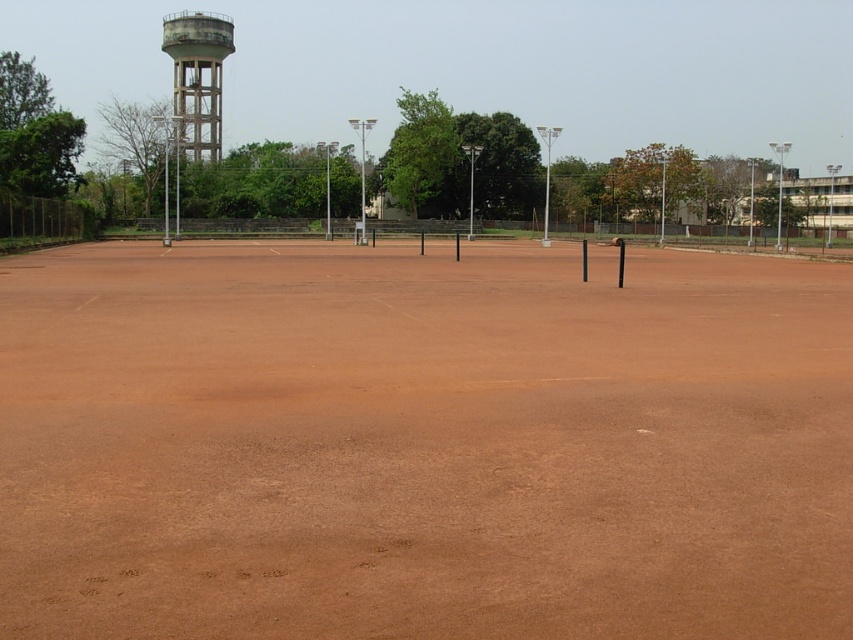
Question: Is the position of brown clay court at center more distant than that of concrete water tower at upper left?

Choices:
 (A) yes
 (B) no

Answer: (B)

Question: Which point is farther from the camera taking this photo?

Choices:
 (A) (657, 449)
 (B) (183, 49)

Answer: (B)

Question: Can you confirm if brown clay court at center is smaller than concrete water tower at upper left?

Choices:
 (A) no
 (B) yes

Answer: (B)

Question: Among these objects, which one is farthest from the camera?

Choices:
 (A) concrete water tower at upper left
 (B) brown clay court at center

Answer: (A)

Question: Is brown clay court at center wider than concrete water tower at upper left?

Choices:
 (A) no
 (B) yes

Answer: (A)